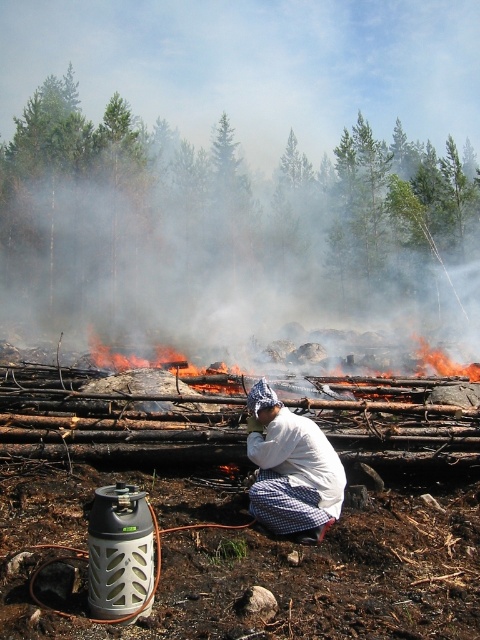
Where is the white cotton shirt at center located in the image?

The white cotton shirt at center is located at point (x=290, y=468).

Based on the coordinates provided, what object is located at point [290,468] in the image?

The point [290,468] indicates the white cotton shirt at center.